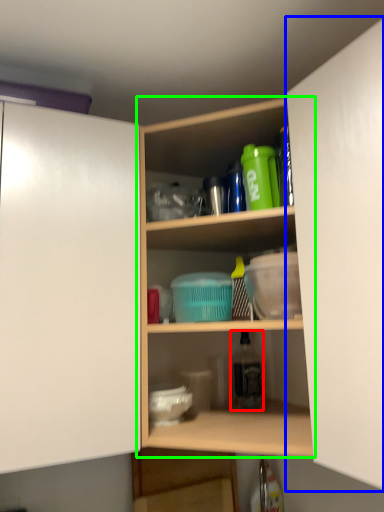
Question: Considering the real-world distances, which object is farthest from bottle (highlighted by a red box)? cabinetry (highlighted by a blue box) or shelf (highlighted by a green box)?

Choices:
 (A) cabinetry
 (B) shelf

Answer: (A)